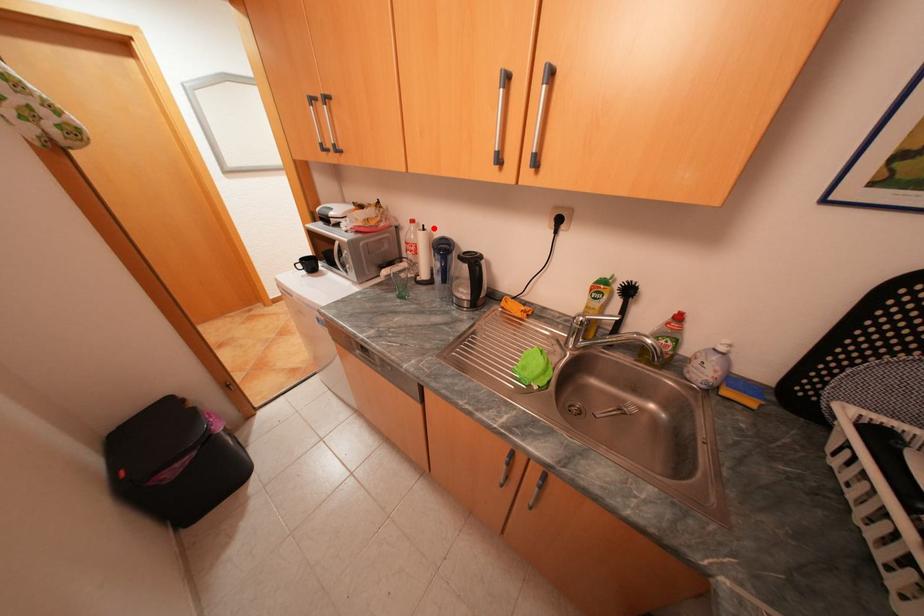
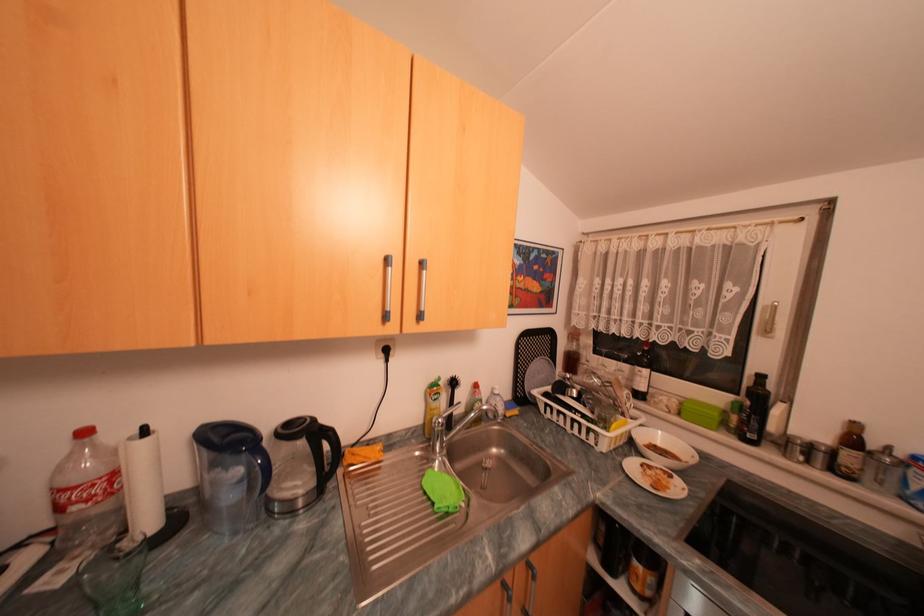
The point at the highlighted location is marked in the first image. Where is the corresponding point in the second image?

(155, 432)